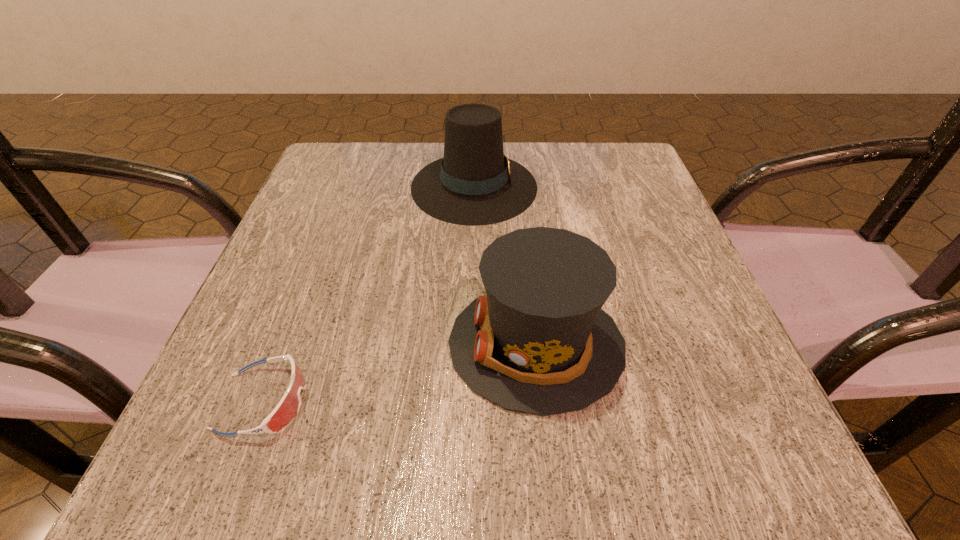
Where is `the farthest object`? the farthest object is located at coordinates (475, 184).

Where is `the nearer dress hat`? This screenshot has width=960, height=540. the nearer dress hat is located at coordinates (x=538, y=342).

The width and height of the screenshot is (960, 540). In order to click on the shortest object in this screenshot , I will do `click(288, 407)`.

Where is `the leftmost object`? the leftmost object is located at coordinates (288, 407).

In order to click on vacant space situated on the front-facing side of the farther dress hat in this screenshot , I will do `click(583, 186)`.

Locate an element on the screen. This screenshot has height=540, width=960. vacant region located with goggles on the front of the nearer dress hat is located at coordinates (342, 344).

The width and height of the screenshot is (960, 540). Find the location of `blank space located 0.110m with goggles on the front of the nearer dress hat`. blank space located 0.110m with goggles on the front of the nearer dress hat is located at coordinates (375, 344).

Image resolution: width=960 pixels, height=540 pixels. I want to click on free space located with goggles on the front of the nearer dress hat, so click(242, 344).

Where is `free point located on the front-facing side of the leftmost object`? The height and width of the screenshot is (540, 960). free point located on the front-facing side of the leftmost object is located at coordinates (499, 401).

Where is `object positioned at the far edge`? The width and height of the screenshot is (960, 540). object positioned at the far edge is located at coordinates (475, 184).